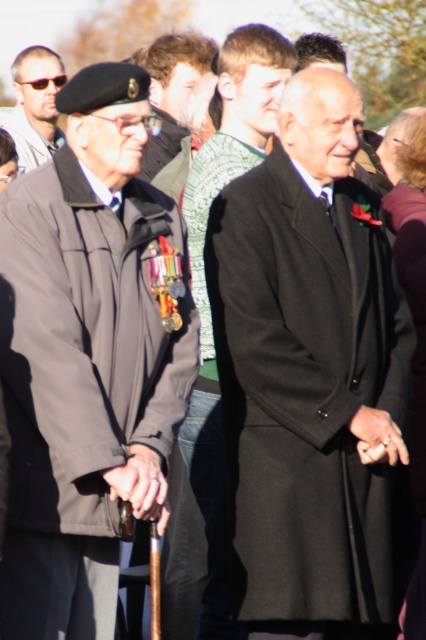
Question: From the image, what is the correct spatial relationship of matte black jacket at left in relation to matte black beret at center?

Choices:
 (A) right
 (B) left

Answer: (A)

Question: Which point is farther to the camera?

Choices:
 (A) (199, 445)
 (B) (190, 56)
 (C) (17, 252)
 (D) (49, 150)

Answer: (D)

Question: Does black wool coat at center have a greater width compared to matte black sunglasses at upper left?

Choices:
 (A) no
 (B) yes

Answer: (B)

Question: In this image, where is dark gray wool coat at center located relative to matte black beret at center?

Choices:
 (A) right
 (B) left

Answer: (A)

Question: Which object is the farthest from the matte black beret at center?

Choices:
 (A) matte black sunglasses at upper left
 (B) matte black jacket at left

Answer: (B)

Question: Which of these objects is positioned closest to the dark gray wool coat at center?

Choices:
 (A) matte black sunglasses at upper left
 (B) matte black beret at center

Answer: (B)